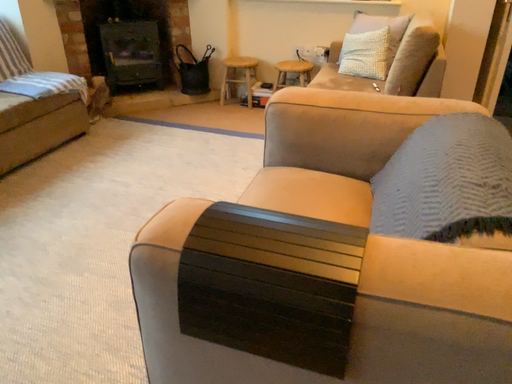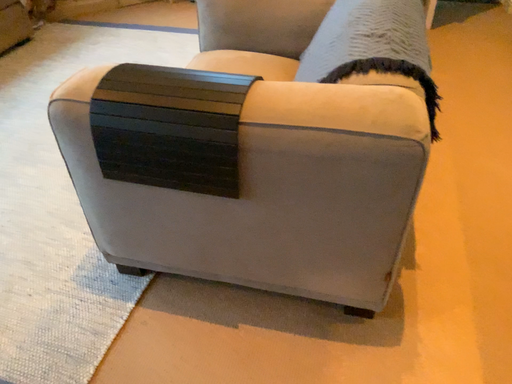
Question: Which way did the camera rotate in the video?

Choices:
 (A) rotated upward
 (B) rotated downward

Answer: (B)